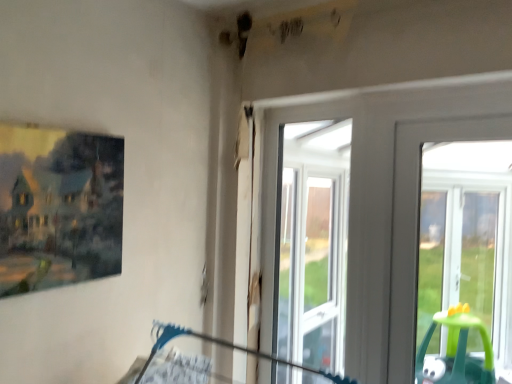
This screenshot has height=384, width=512. Describe the element at coordinates (312, 243) in the screenshot. I see `clear glass window at center` at that location.

Where is `clear glass window at center`? clear glass window at center is located at coordinates (312, 243).

Image resolution: width=512 pixels, height=384 pixels. What do you see at coordinates (58, 207) in the screenshot?
I see `matte wooden picture frame at left` at bounding box center [58, 207].

The image size is (512, 384). In order to click on matte wooden picture frame at left in this screenshot , I will do `click(58, 207)`.

This screenshot has width=512, height=384. In order to click on clear glass window at center in this screenshot , I will do `click(312, 243)`.

Based on their positions, is matte wooden picture frame at left located to the left or right of clear glass window at center?

Clearly, matte wooden picture frame at left is on the left of clear glass window at center in the image.

Which object is further away from the camera taking this photo, matte wooden picture frame at left or clear glass window at center?

clear glass window at center is further from the camera.

Between point (13, 147) and point (288, 166), which one is positioned behind?

The point (288, 166) is more distant.

From the image's perspective, relative to clear glass window at center, is matte wooden picture frame at left above or below?

matte wooden picture frame at left is situated higher than clear glass window at center in the image.

From a real-world perspective, is matte wooden picture frame at left positioned over clear glass window at center based on gravity?

Yes.

Which of these two, matte wooden picture frame at left or clear glass window at center, is thinner?

Thinner between the two is clear glass window at center.

Considering the sizes of objects matte wooden picture frame at left and clear glass window at center in the image provided, who is taller, matte wooden picture frame at left or clear glass window at center?

clear glass window at center.

Can you confirm if matte wooden picture frame at left is bigger than clear glass window at center?

No, matte wooden picture frame at left is not bigger than clear glass window at center.

Is matte wooden picture frame at left inside or outside of clear glass window at center?

matte wooden picture frame at left is not enclosed by clear glass window at center.

In the scene shown: Are matte wooden picture frame at left and clear glass window at center beside each other?

No.

From the picture: Is clear glass window at center at the back of matte wooden picture frame at left?

matte wooden picture frame at left is not turned away from clear glass window at center.

Where is `bay window below the matte wooden picture frame at left (from the image's perspective)`? bay window below the matte wooden picture frame at left (from the image's perspective) is located at coordinates (312, 243).

Does clear glass window at center appear on the right side of matte wooden picture frame at left?

Correct, you'll find clear glass window at center to the right of matte wooden picture frame at left.

Is the depth of clear glass window at center less than that of matte wooden picture frame at left?

No, it is not.

Is point (300, 269) farther from camera compared to point (21, 145)?

Yes.

From the image's perspective, is clear glass window at center located above or below matte wooden picture frame at left?

clear glass window at center is below matte wooden picture frame at left.

From a real-world perspective, is clear glass window at center physically located above or below matte wooden picture frame at left?

In terms of real-world spatial position, clear glass window at center is below matte wooden picture frame at left.

Looking at their sizes, would you say clear glass window at center is wider or thinner than matte wooden picture frame at left?

Considering their sizes, clear glass window at center looks slimmer than matte wooden picture frame at left.

Considering the sizes of objects clear glass window at center and matte wooden picture frame at left in the image provided, who is shorter, clear glass window at center or matte wooden picture frame at left?

Standing shorter between the two is matte wooden picture frame at left.

Between clear glass window at center and matte wooden picture frame at left, which one has larger size?

clear glass window at center is bigger.

Looking at this image, would you say matte wooden picture frame at left is part of clear glass window at center's contents?

Actually, matte wooden picture frame at left is outside clear glass window at center.

Looking at this image, is there a large distance between clear glass window at center and matte wooden picture frame at left?

clear glass window at center is far away from matte wooden picture frame at left.

Is clear glass window at center looking in the opposite direction of matte wooden picture frame at left?

No, matte wooden picture frame at left is not at the back of clear glass window at center.

Can you tell me how much clear glass window at center and matte wooden picture frame at left differ in facing direction?

The facing directions of clear glass window at center and matte wooden picture frame at left are 89.1 degrees apart.

Where is `picture frame in front of the clear glass window at center`? picture frame in front of the clear glass window at center is located at coordinates (58, 207).

Identify the location of picture frame in front of the clear glass window at center. (58, 207).

You are a GUI agent. You are given a task and a screenshot of the screen. Output one action in this format:
    pyautogui.click(x=<x>, y=<y>)
    Task: Click on the picture frame lying on the left of clear glass window at center
    Image resolution: width=512 pixels, height=384 pixels.
    Given the screenshot: What is the action you would take?
    pyautogui.click(x=58, y=207)